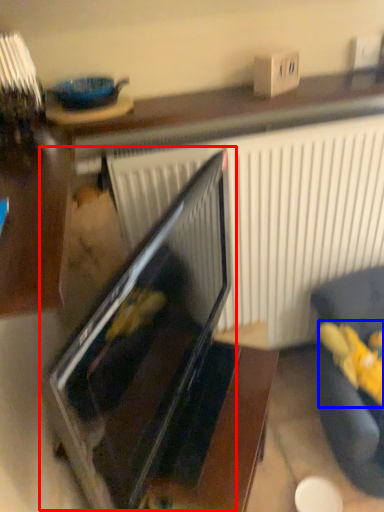
Question: Which object is further to the camera taking this photo, oven (highlighted by a red box) or stuff (highlighted by a blue box)?

Choices:
 (A) oven
 (B) stuff

Answer: (B)